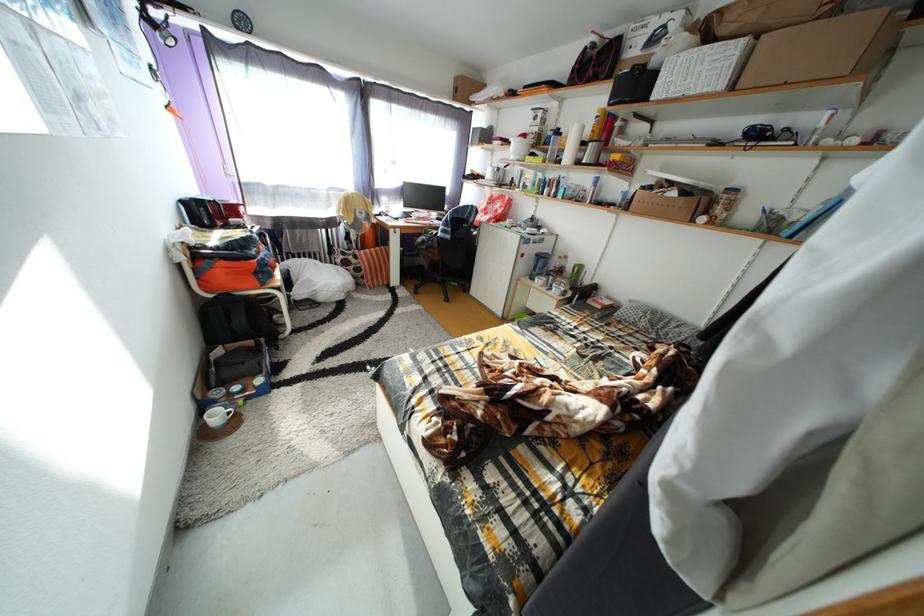
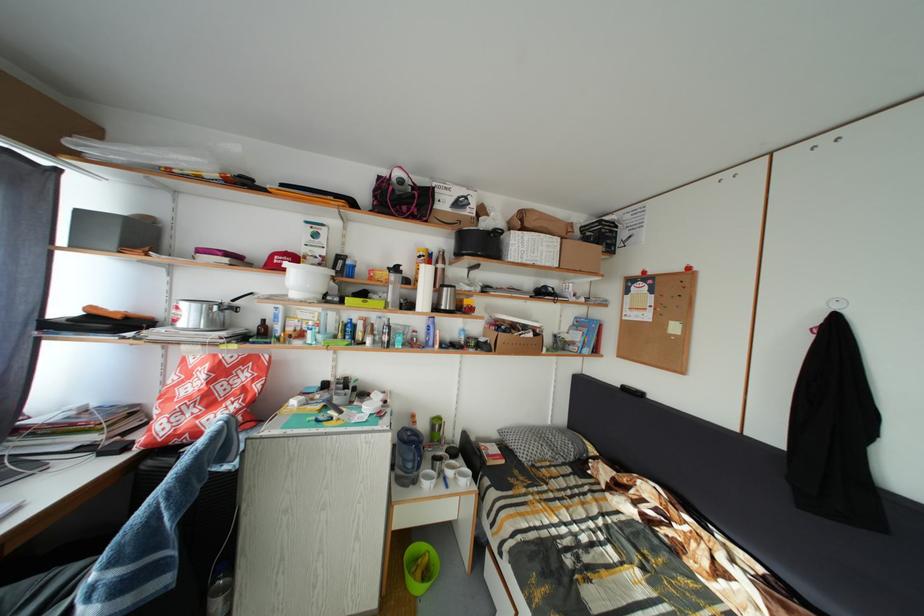
Find the pixel in the second image that matches point (563, 293) in the first image.

(458, 480)